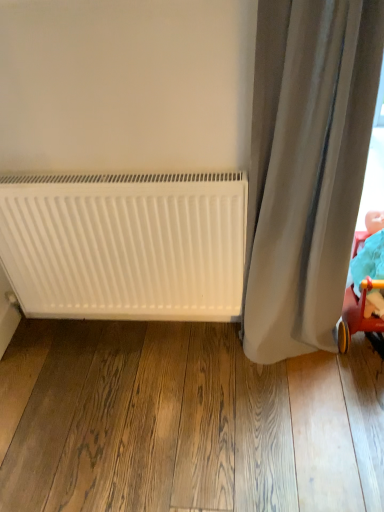
What are the coordinates of `vacant region below gray fabric curtain at right (from a real-world perspective)` in the screenshot? It's located at (292, 355).